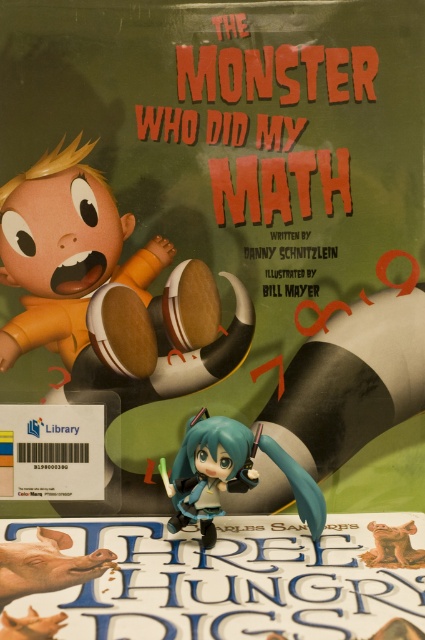
Question: Can you confirm if matte orange plush toy at upper left is thinner than semi-glossy black figurine at center?

Choices:
 (A) yes
 (B) no

Answer: (B)

Question: Is matte orange plush toy at upper left bigger than semi-glossy black figurine at center?

Choices:
 (A) yes
 (B) no

Answer: (A)

Question: Where is matte orange plush toy at upper left located in relation to semi-glossy black figurine at center in the image?

Choices:
 (A) below
 (B) above

Answer: (B)